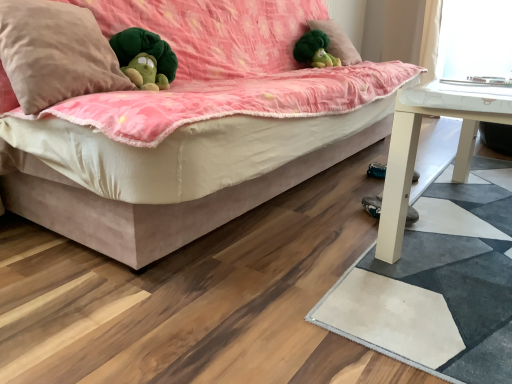
Locate an element on the screen. free spot in front of black suede shoe at lower right is located at coordinates (417, 240).